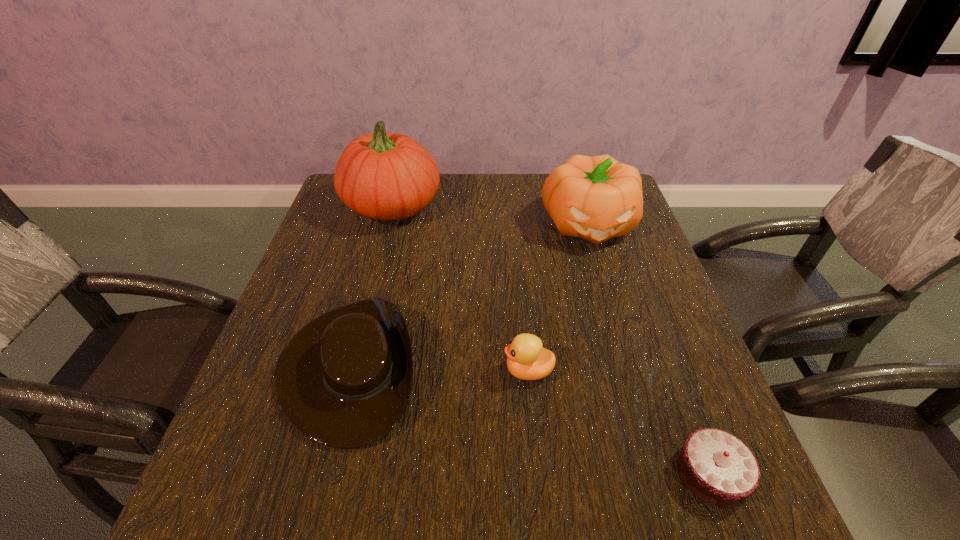
Where is `object situated at the far left corner`? Image resolution: width=960 pixels, height=540 pixels. object situated at the far left corner is located at coordinates (384, 176).

Where is `object located in the far right corner section of the desktop`? The image size is (960, 540). object located in the far right corner section of the desktop is located at coordinates (596, 198).

Where is `object that is at the near right corner`? object that is at the near right corner is located at coordinates (716, 466).

Identify the location of free spot at the far edge of the desktop. (502, 206).

You are a GUI agent. You are given a task and a screenshot of the screen. Output one action in this format:
    pyautogui.click(x=<x>, y=<y>)
    Task: Click on the free region at the near edge
    Image resolution: width=960 pixels, height=540 pixels.
    Given the screenshot: What is the action you would take?
    coord(372,514)

In the image, there is a desktop. At what (x,y) coordinates should I click in order to perform the action: click on free region at the left edge. Please return your answer as a coordinate pair (x, y). Image resolution: width=960 pixels, height=540 pixels. Looking at the image, I should click on (325, 276).

The image size is (960, 540). In the image, there is a desktop. In order to click on vacant space at the right edge in this screenshot , I will do `click(619, 343)`.

Find the location of a particular element. This screenshot has height=540, width=960. free space between the right pumpkin and the left pumpkin is located at coordinates (491, 215).

The image size is (960, 540). What are the coordinates of `vacant region between the taller pumpkin and the chocolate cake` in the screenshot? It's located at (552, 339).

Find the location of a particular element. free space between the chocolate cake and the left pumpkin is located at coordinates (552, 339).